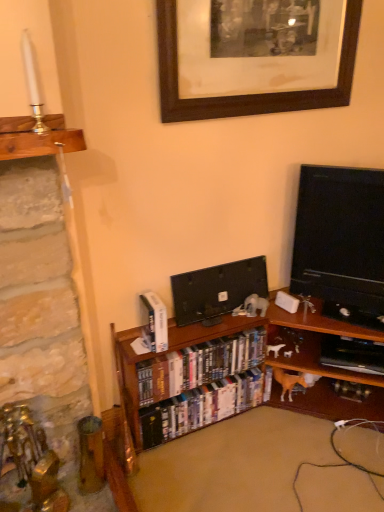
Question: Relative to black wood picture frame at upper center, is hardcover books at center, acting as the 1th book starting from the bottom, in front or behind?

Choices:
 (A) front
 (B) behind

Answer: (B)

Question: From the image's perspective, is hardcover books at center, the third book positioned from the top, above or below black wood picture frame at upper center?

Choices:
 (A) below
 (B) above

Answer: (A)

Question: Based on their relative distances, which object is farther from the white glossy book at center, placed as the 3th book when sorted from bottom to top?

Choices:
 (A) black glossy tv at right, which ranks as the 2th television in left-to-right order
 (B) shiny plastic dvds at center, positioned as the 2th book in top-to-bottom order
 (C) hardcover books at center, the third book positioned from the top
 (D) black glossy flat-screen tv at center, marked as the first television in a left-to-right arrangement
 (E) black wood picture frame at upper center

Answer: (E)

Question: Which object is positioned farthest from the wooden bookcase at center?

Choices:
 (A) hardcover books at center, acting as the 1th book starting from the bottom
 (B) shiny plastic dvds at center, the second book ordered from the bottom
 (C) white glossy book at center, placed as the first book when sorted from top to bottom
 (D) black glossy tv at right, the 1th television when ordered from right to left
 (E) black glossy flat-screen tv at center, placed as the second television when sorted from right to left

Answer: (D)